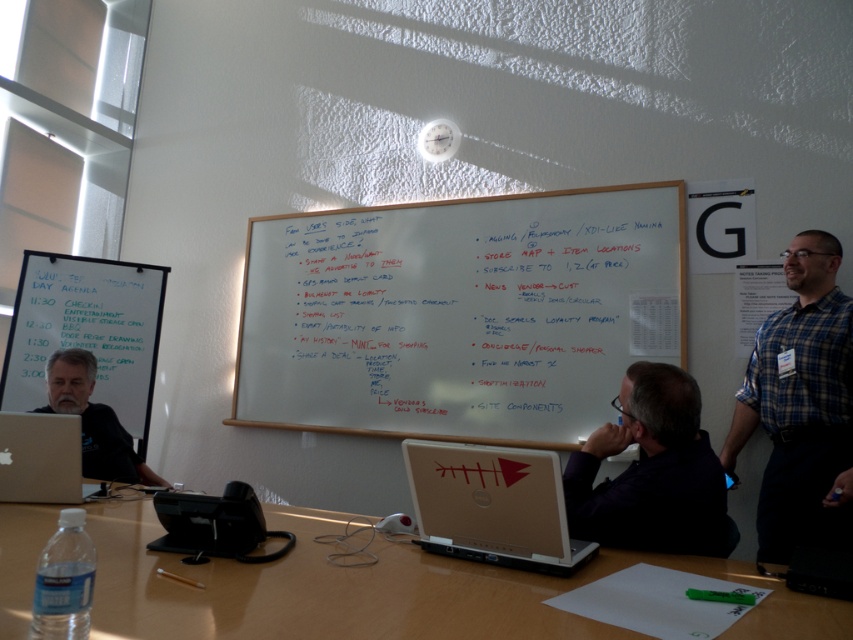
Can you confirm if white matte laptop at center is wider than matte black laptop at left?

In fact, white matte laptop at center might be narrower than matte black laptop at left.

Does white matte laptop at center appear under matte black laptop at left?

Indeed, white matte laptop at center is positioned under matte black laptop at left.

Who is more forward, (436, 506) or (135, 460)?

Point (436, 506)

You are a GUI agent. You are given a task and a screenshot of the screen. Output one action in this format:
    pyautogui.click(x=<x>, y=<y>)
    Task: Click on the white matte laptop at center
    The height and width of the screenshot is (640, 853).
    Given the screenshot: What is the action you would take?
    pyautogui.click(x=492, y=506)

Between blue plaid shirt at right and whiteboard at upper left, which one appears on the left side from the viewer's perspective?

whiteboard at upper left

Is point (827, 301) closer to viewer compared to point (109, 365)?

Yes, point (827, 301) is in front of point (109, 365).

The width and height of the screenshot is (853, 640). I want to click on blue plaid shirt at right, so click(x=801, y=404).

Does whiteboard at center appear over dark blue shirt at center?

Indeed, whiteboard at center is positioned over dark blue shirt at center.

Does point (338, 237) come in front of point (659, 502)?

No.

Locate an element on the screen. whiteboard at center is located at coordinates (460, 314).